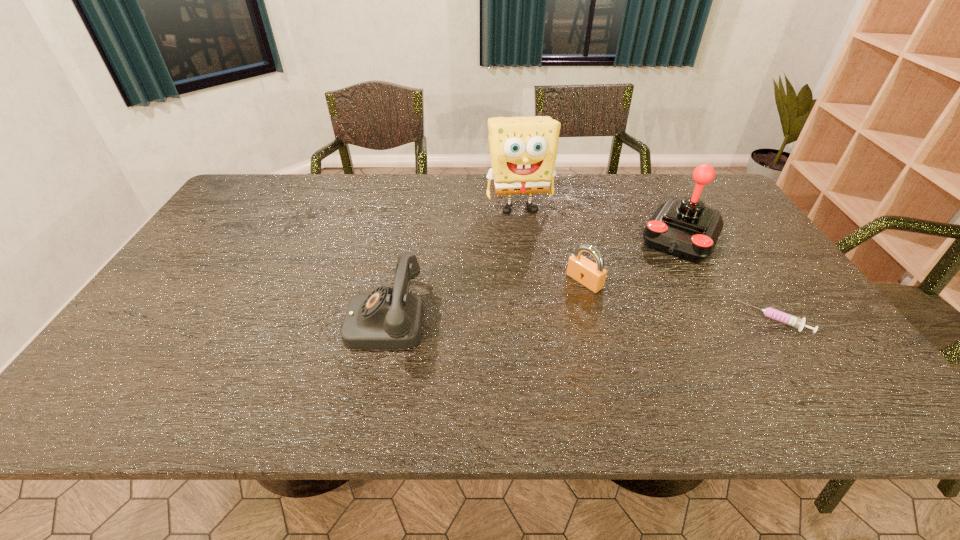
At what (x,y) coordinates should I click in order to perform the action: click on vacant spot on the desktop that is between the leftmost object and the shortest object and is positioned on the face of the sponge. Please return your answer as a coordinate pair (x, y). This screenshot has height=540, width=960. Looking at the image, I should click on (550, 319).

I want to click on free space on the desktop that is between the leftmost object and the syringe and is positioned on the base of the second tallest object, so click(x=636, y=319).

Find the location of a particular element. The image size is (960, 540). free space on the desktop that is between the third tallest object and the shortest object and is positioned to unlock the padlock from the front is located at coordinates (530, 319).